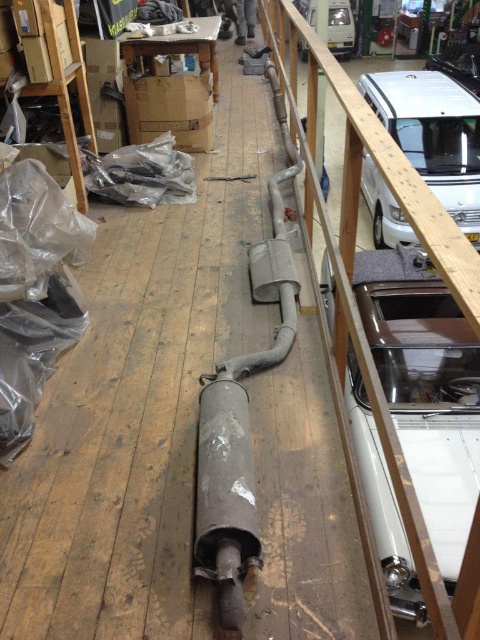
Question: Which object appears farthest from the camera in this image?

Choices:
 (A) white matte van at upper center
 (B) silver metallic van at upper right
 (C) wooden at upper right

Answer: (A)

Question: Is wooden at upper right wider than metallic silver car at upper right?

Choices:
 (A) no
 (B) yes

Answer: (A)

Question: Estimate the real-world distances between objects in this image. Which object is closer to the wooden at upper right?

Choices:
 (A) white matte van at upper center
 (B) metallic silver car at upper right
 (C) silver metallic van at upper right

Answer: (C)

Question: Can you confirm if silver metallic van at upper right is positioned to the right of white matte van at upper center?

Choices:
 (A) no
 (B) yes

Answer: (B)

Question: Which point is closer to the camera?

Choices:
 (A) (370, 120)
 (B) (479, 93)

Answer: (A)

Question: Is wooden at upper right wider than silver metallic van at upper right?

Choices:
 (A) no
 (B) yes

Answer: (A)